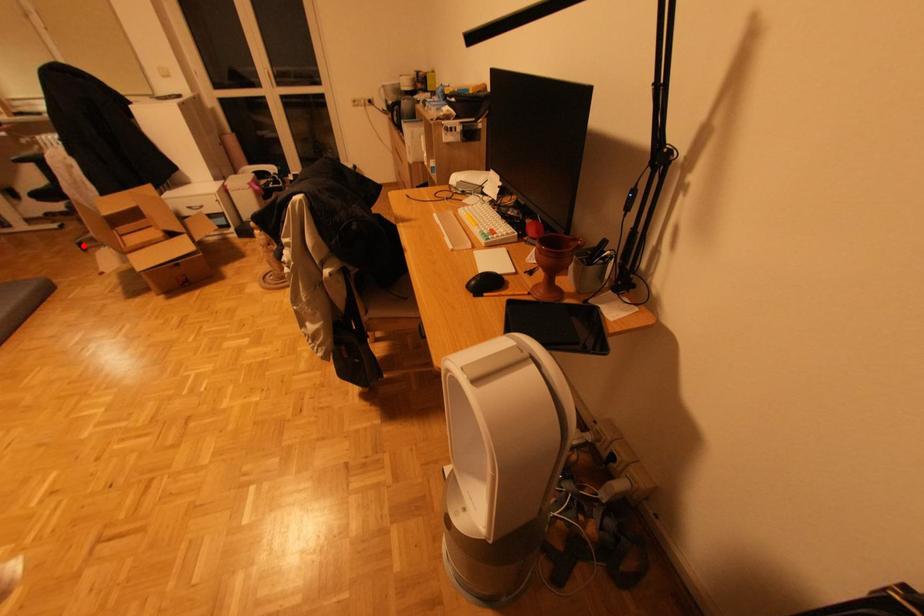
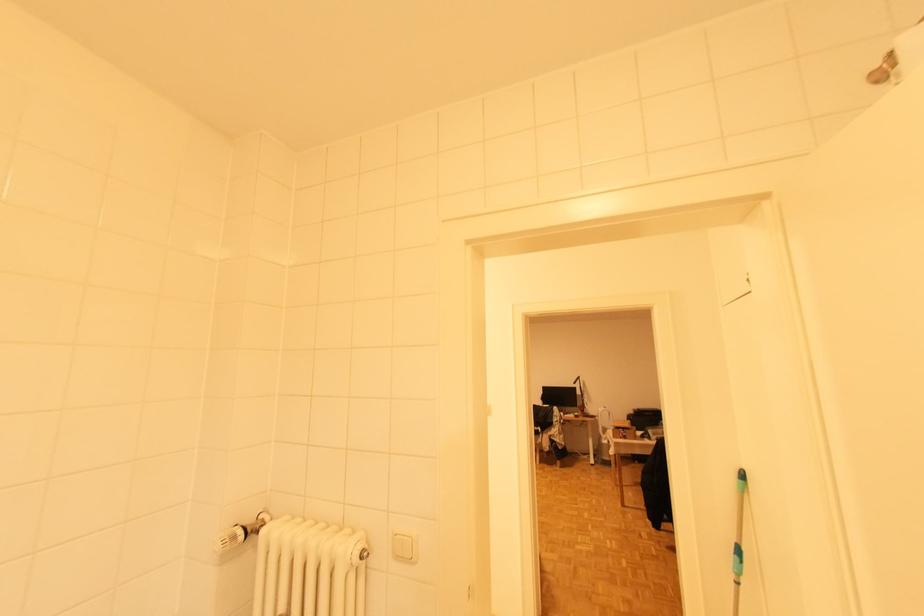
Question: I am providing you with two images of the same scene from different viewpoints. A red point is marked on the first image. Can you still see the location of the red point in image 2?

Choices:
 (A) Yes
 (B) No

Answer: (B)